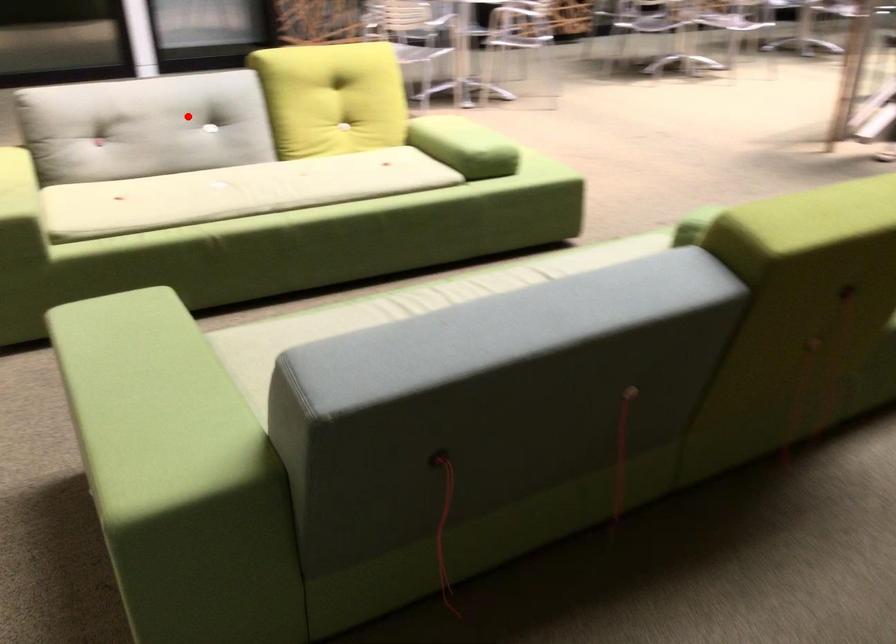
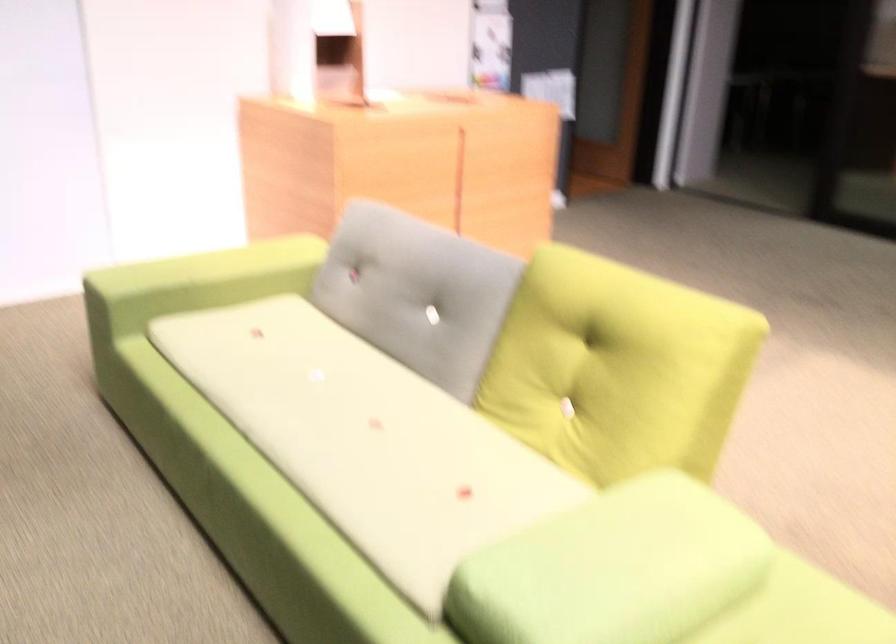
Find the pixel in the second image that matches the highlighted location in the first image.

(417, 292)